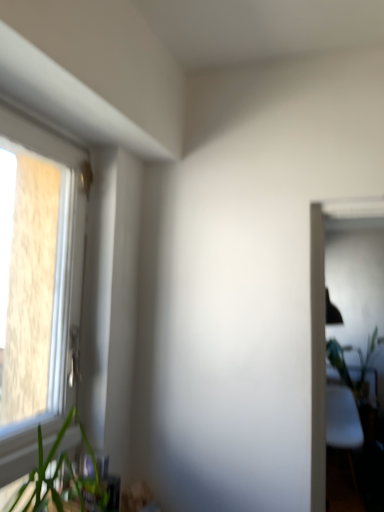
Question: Is green leafy plant at right inside or outside of white plastic window at left?

Choices:
 (A) outside
 (B) inside

Answer: (A)

Question: Is green leafy plant at right bigger or smaller than white plastic window at left?

Choices:
 (A) big
 (B) small

Answer: (A)

Question: Which object is the farthest from the white plastic window at left?

Choices:
 (A) green leafy plant at right
 (B) green leafy plant at lower left

Answer: (A)

Question: Which of these objects is positioned farthest from the green leafy plant at lower left?

Choices:
 (A) green leafy plant at right
 (B) white plastic window at left

Answer: (A)